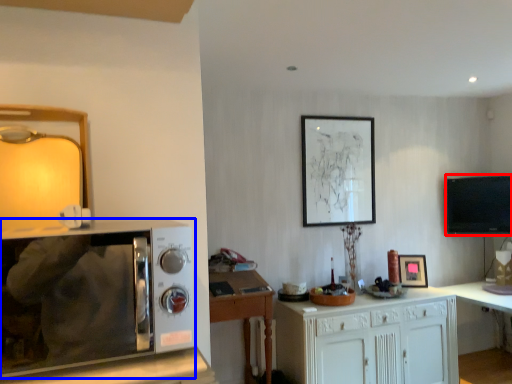
Question: Which of the following is the farthest to the observer, television (highlighted by a red box) or microwave oven (highlighted by a blue box)?

Choices:
 (A) television
 (B) microwave oven

Answer: (A)